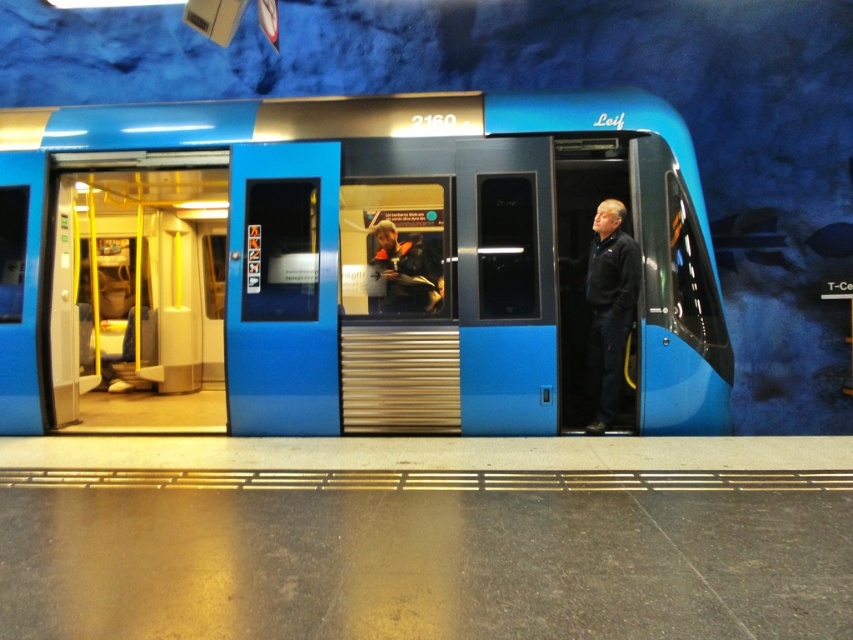
Which is in front, point (328, 276) or point (595, 268)?

Point (328, 276) is in front.

Find the location of a particular element. The image size is (853, 640). blue glossy door at center is located at coordinates (282, 291).

You are a GUI agent. You are given a task and a screenshot of the screen. Output one action in this format:
    pyautogui.click(x=<x>, y=<y>)
    Task: Click on the blue glossy door at center
    Image resolution: width=853 pixels, height=640 pixels.
    Given the screenshot: What is the action you would take?
    pyautogui.click(x=282, y=291)

In the scene shown: Is blue metallic train at center smaller than dark blue jacket at center?

Indeed, blue metallic train at center has a smaller size compared to dark blue jacket at center.

Which is in front, point (584, 339) or point (621, 321)?

Point (621, 321)

Between point (602, 163) and point (601, 253), which one is positioned behind?

The point (602, 163) is behind.

The height and width of the screenshot is (640, 853). What are the coordinates of `blue metallic train at center` in the screenshot? It's located at (352, 266).

Who is shorter, blue metallic train at center or blue glossy door at center?

blue metallic train at center is shorter.

Who is positioned more to the left, blue metallic train at center or blue glossy door at center?

blue metallic train at center is more to the left.

You are a GUI agent. You are given a task and a screenshot of the screen. Output one action in this format:
    pyautogui.click(x=<x>, y=<y>)
    Task: Click on the blue metallic train at center
    This screenshot has width=853, height=640.
    Given the screenshot: What is the action you would take?
    352,266

You are a GUI agent. You are given a task and a screenshot of the screen. Output one action in this format:
    pyautogui.click(x=<x>, y=<y>)
    Task: Click on the blue metallic train at center
    The width and height of the screenshot is (853, 640).
    Given the screenshot: What is the action you would take?
    pyautogui.click(x=352, y=266)